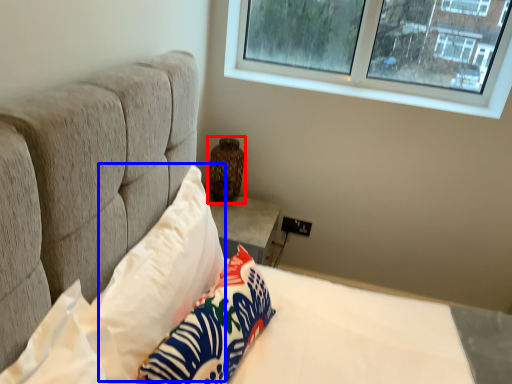
Question: Which of the following is the farthest to the observer, vase (highlighted by a red box) or pillow (highlighted by a blue box)?

Choices:
 (A) vase
 (B) pillow

Answer: (A)